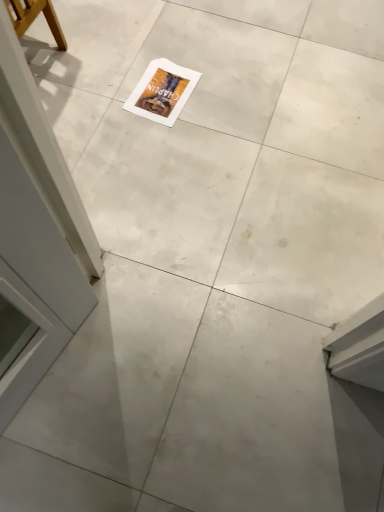
Where is `white paper postcard at center`? This screenshot has height=512, width=384. white paper postcard at center is located at coordinates (162, 91).

This screenshot has height=512, width=384. Describe the element at coordinates (162, 91) in the screenshot. I see `white paper postcard at center` at that location.

The width and height of the screenshot is (384, 512). Identify the location of white paper postcard at center. (162, 91).